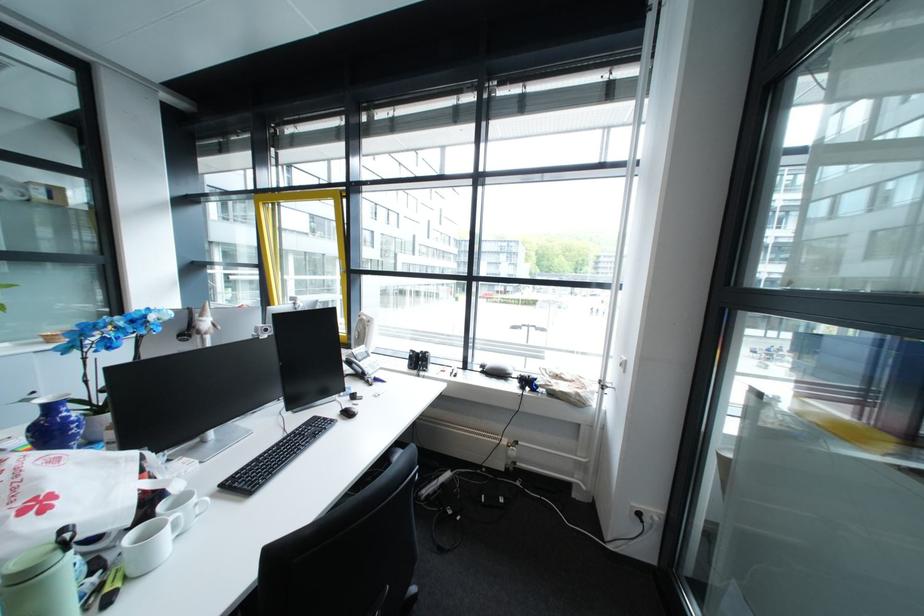
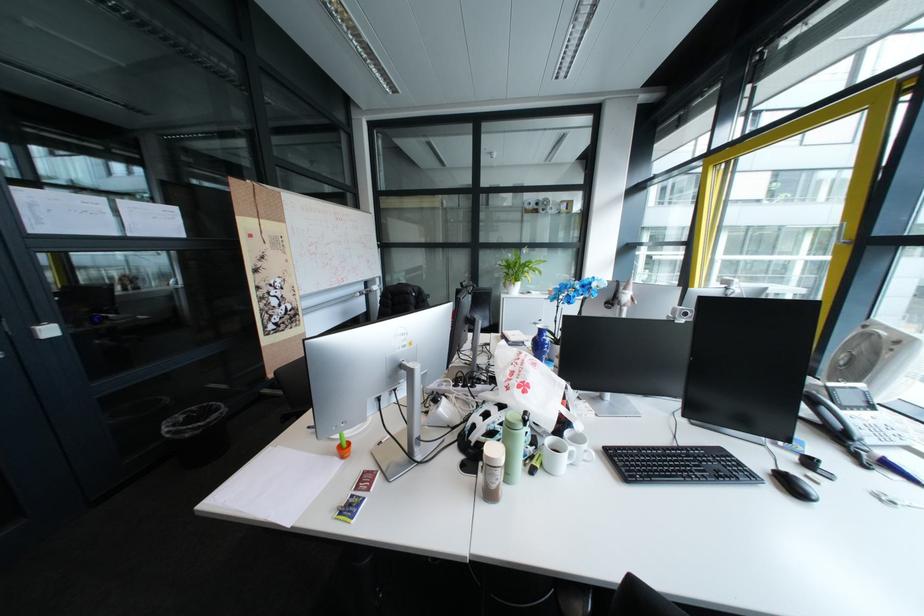
Question: The images are taken continuously from a first-person perspective. In which direction is your viewpoint rotating?

Choices:
 (A) Left
 (B) Right
 (C) Up
 (D) Down

Answer: (A)